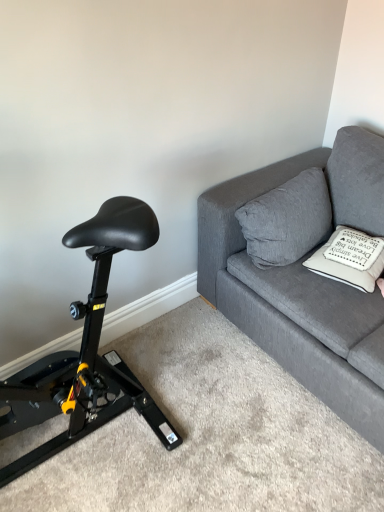
Locate an element on the screen. This screenshot has height=512, width=384. free space underneath black leather saddle at left (from a real-world perspective) is located at coordinates (104, 446).